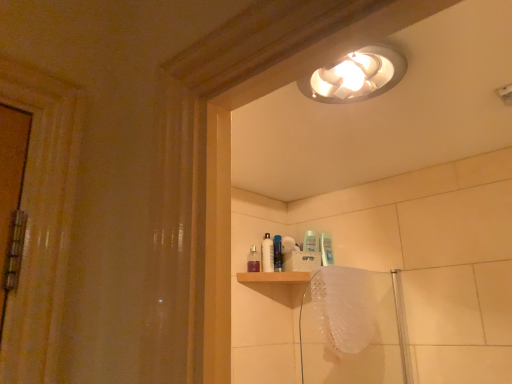
Question: Considering the positions of translucent plastic spray bottle at upper center, which is the first toiletry in left-to-right order, and translucent plastic shower door at lower right in the image, is translucent plastic spray bottle at upper center, which is the first toiletry in left-to-right order, taller or shorter than translucent plastic shower door at lower right?

Choices:
 (A) short
 (B) tall

Answer: (A)

Question: Does point (250, 249) appear closer or farther from the camera than point (356, 332)?

Choices:
 (A) closer
 (B) farther

Answer: (B)

Question: Which is farther from the translucent plastic bath towel at lower right?

Choices:
 (A) translucent plastic shower door at lower right
 (B) translucent plastic spray bottle at upper center, which is the first toiletry in left-to-right order
 (C) white plastic bottle at center, which is the 2th toiletry from right to left
 (D) blue glossy bottle at center, positioned as the 1th toiletry in right-to-left order

Answer: (B)

Question: Which object is the closest to the translucent plastic bath towel at lower right?

Choices:
 (A) translucent plastic spray bottle at upper center, the third toiletry from the right
 (B) white plastic bottle at center, which is the 2th toiletry from right to left
 (C) blue glossy bottle at center, which ranks as the third toiletry in left-to-right order
 (D) translucent plastic shower door at lower right

Answer: (D)